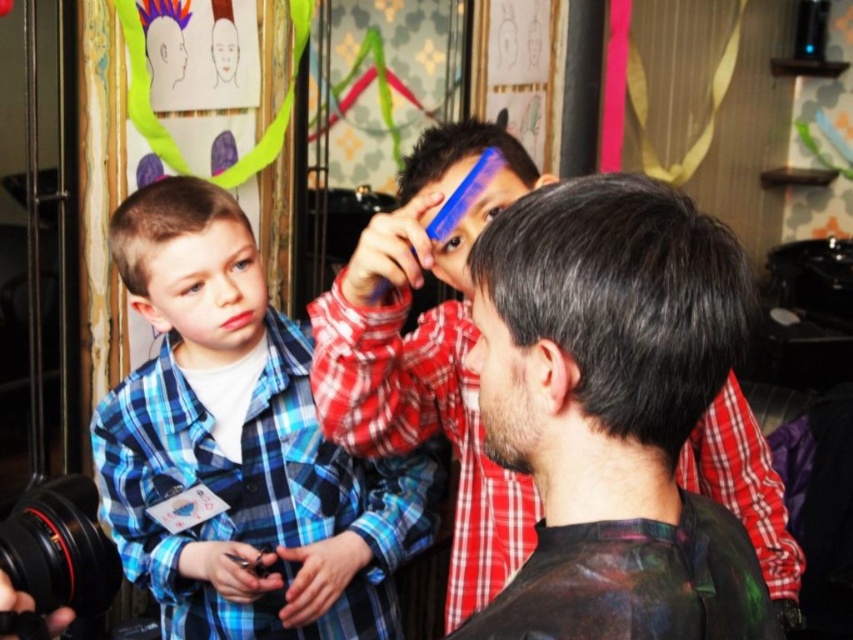
Question: Which point is farther to the camera?

Choices:
 (A) (421, 228)
 (B) (140, 237)

Answer: (B)

Question: Where is dark matte hair at center located in relation to blue plastic comb at upper center in the image?

Choices:
 (A) right
 (B) left

Answer: (A)

Question: Which object is farther from the camera taking this photo?

Choices:
 (A) dark matte hair at center
 (B) short brown hair at left
 (C) blue plastic comb at upper center
 (D) blue plaid shirt at left

Answer: (D)

Question: Is blue plaid shirt at left positioned at the back of blue plastic comb at upper center?

Choices:
 (A) yes
 (B) no

Answer: (A)

Question: Does dark matte hair at center appear under short brown hair at left?

Choices:
 (A) no
 (B) yes

Answer: (B)

Question: Estimate the real-world distances between objects in this image. Which object is closer to the dark matte hair at center?

Choices:
 (A) shiny black hair at center
 (B) blue plaid shirt at left
 (C) blue plastic comb at upper center

Answer: (A)